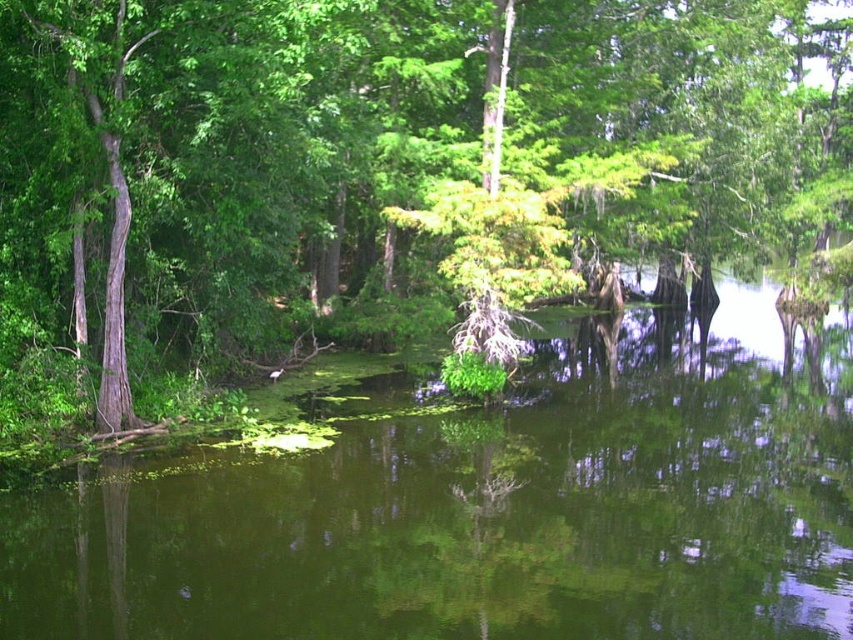
Question: Where is green leafy tree at center located in relation to green algae at center in the image?

Choices:
 (A) above
 (B) below

Answer: (A)

Question: Does green leafy tree at center appear on the left side of green algae at center?

Choices:
 (A) yes
 (B) no

Answer: (B)

Question: Is green leafy tree at center to the right of green algae at center from the viewer's perspective?

Choices:
 (A) yes
 (B) no

Answer: (A)

Question: Among these objects, which one is farthest from the camera?

Choices:
 (A) green algae at center
 (B) green leafy tree at center

Answer: (B)

Question: Among these objects, which one is nearest to the camera?

Choices:
 (A) green leafy tree at center
 (B) green algae at center

Answer: (B)